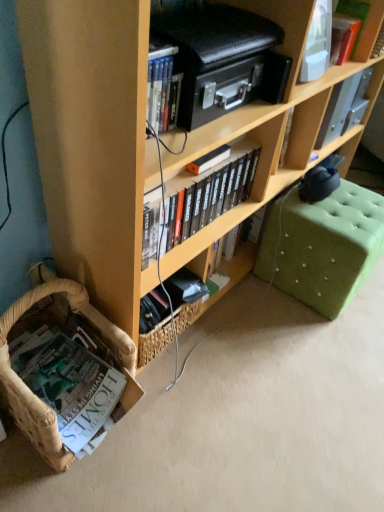
The image size is (384, 512). Identify the location of vacant area that lies to the right of white paper book at lower left, the 3th book when ordered from top to bottom. (171, 434).